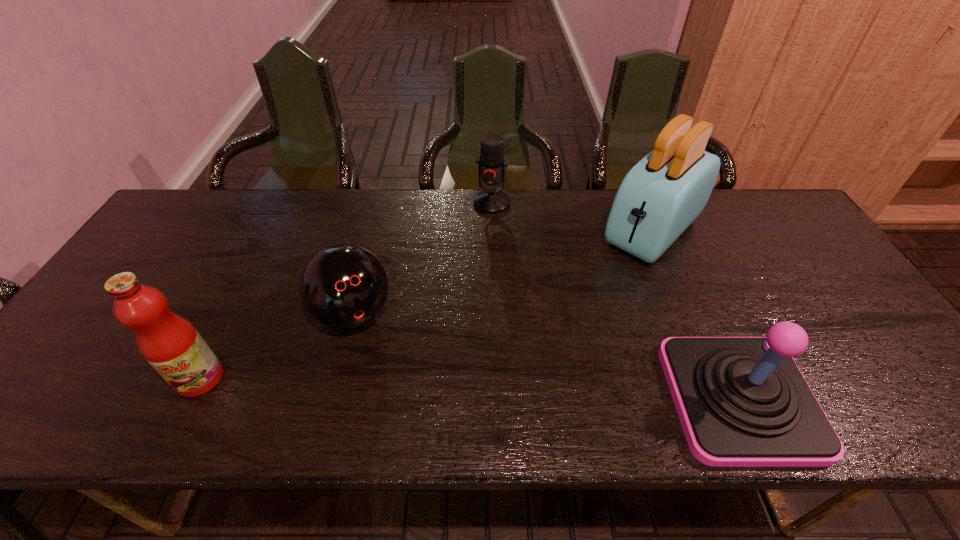
This screenshot has height=540, width=960. Find the location of `vacant space located 0.090m on the surface of the bowling ball near the finger holes`. vacant space located 0.090m on the surface of the bowling ball near the finger holes is located at coordinates (381, 370).

This screenshot has width=960, height=540. What are the coordinates of `vacant space situated 0.080m on the side of the toaster with the lever` in the screenshot? It's located at (610, 275).

What are the coordinates of `free space located on the side of the toaster with the lever` in the screenshot? It's located at (551, 333).

You are a GUI agent. You are given a task and a screenshot of the screen. Output one action in this format:
    pyautogui.click(x=<x>, y=<y>)
    Task: Click on the free point located 0.260m on the side of the toaster with the lever
    
    Given the screenshot: What is the action you would take?
    pyautogui.click(x=572, y=312)

Where is `microphone located in the far edge section of the desktop`? microphone located in the far edge section of the desktop is located at coordinates (492, 164).

This screenshot has width=960, height=540. Find the location of `toaster that is positioned at the far edge`. toaster that is positioned at the far edge is located at coordinates pos(658,199).

Where is `fruit juice at the near edge`? The image size is (960, 540). fruit juice at the near edge is located at coordinates (170, 344).

Locate an element on the screen. The width and height of the screenshot is (960, 540). joystick that is at the near edge is located at coordinates 742,401.

Image resolution: width=960 pixels, height=540 pixels. Find the location of `vacant space at the far edge of the desktop`. vacant space at the far edge of the desktop is located at coordinates (520, 206).

The width and height of the screenshot is (960, 540). Identify the location of vacant space at the near edge. (650, 361).